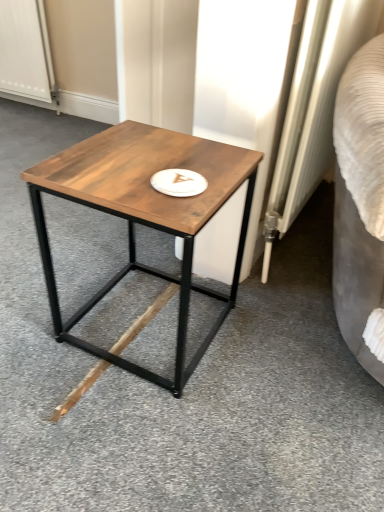
Where is `vacant space behind white matte platter at center`? This screenshot has width=384, height=512. vacant space behind white matte platter at center is located at coordinates (177, 154).